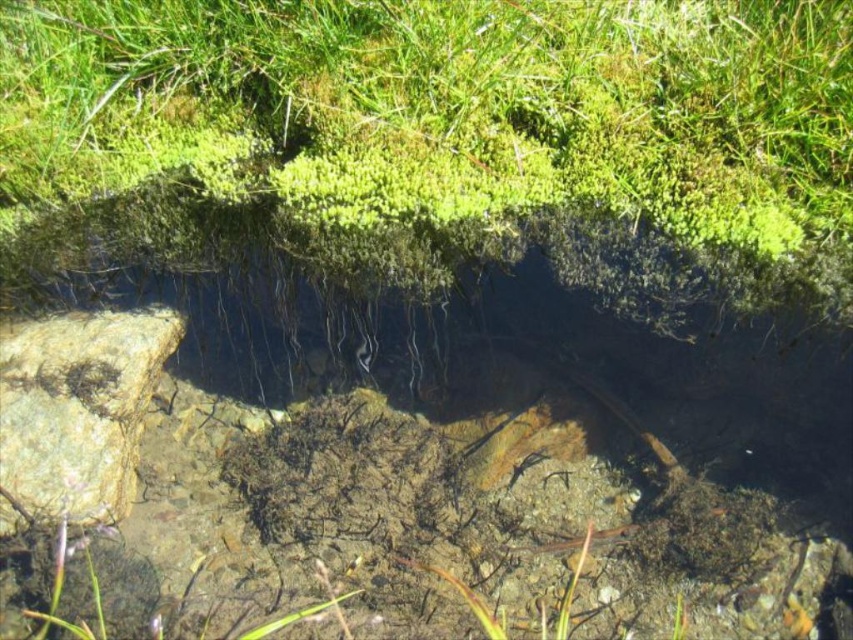
Which is more to the right, green mossy grass at upper center or rough textured rock at left?

From the viewer's perspective, green mossy grass at upper center appears more on the right side.

Between green mossy grass at upper center and rough textured rock at left, which one has less height?

rough textured rock at left

Who is more forward, (431, 28) or (48, 448)?

Positioned in front is point (431, 28).

Image resolution: width=853 pixels, height=640 pixels. What are the coordinates of `green mossy grass at upper center` in the screenshot? It's located at (444, 108).